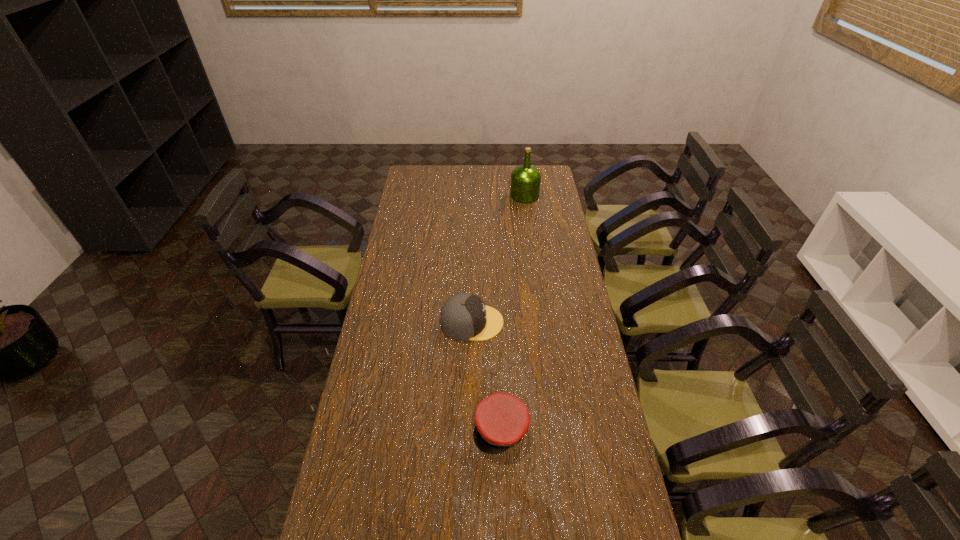
The width and height of the screenshot is (960, 540). In order to click on the farthest object in this screenshot , I will do `click(525, 180)`.

Find the location of a particular element. Image resolution: width=960 pixels, height=540 pixels. olive oil is located at coordinates (525, 180).

This screenshot has width=960, height=540. What are the coordinates of `the farther cap` in the screenshot? It's located at (464, 316).

Where is `the second shortest object`? This screenshot has width=960, height=540. the second shortest object is located at coordinates (464, 316).

Where is `the shortest object`? the shortest object is located at coordinates click(x=502, y=419).

Where is `the nearer cap`? the nearer cap is located at coordinates (502, 419).

Identify the location of free space located on the left of the olive oil. This screenshot has height=540, width=960. (484, 195).

Find the location of a particular element. free spot located on the front-facing side of the second nearest object is located at coordinates (558, 322).

The height and width of the screenshot is (540, 960). Find the location of `vacant space located 0.120m on the front-facing side of the shortest object`. vacant space located 0.120m on the front-facing side of the shortest object is located at coordinates (503, 497).

Where is `object positioned at the right edge`? The image size is (960, 540). object positioned at the right edge is located at coordinates (525, 180).